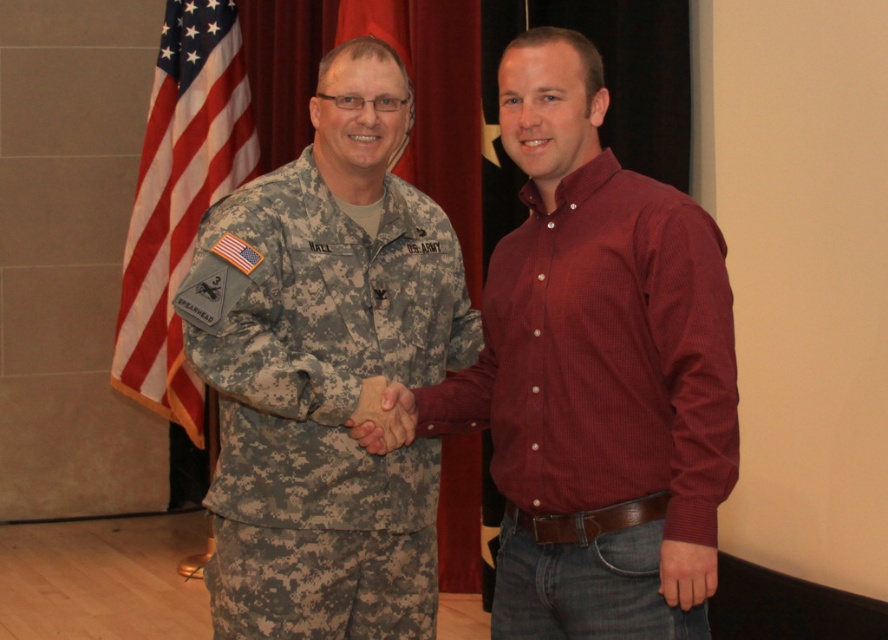
Between american flag at left and red flag at center, which one appears on the right side from the viewer's perspective?

red flag at center is more to the right.

At what (x,y) coordinates should I click in order to perform the action: click on american flag at left. Please return your answer as a coordinate pair (x, y). The width and height of the screenshot is (888, 640). Looking at the image, I should click on (180, 196).

Does american flag at left appear on the left side of matte skin hand at center?

Indeed, american flag at left is positioned on the left side of matte skin hand at center.

From the picture: Is american flag at left behind matte skin hand at center?

Yes, american flag at left is further from the viewer.

Who is more forward, (x=178, y=67) or (x=369, y=390)?

Positioned in front is point (x=369, y=390).

At what (x,y) coordinates should I click in order to perform the action: click on american flag at left. Please return your answer as a coordinate pair (x, y). Looking at the image, I should click on (180, 196).

Between point (236, 296) and point (707, 298), which one is positioned behind?

The point (236, 296) is behind.

Does camouflage fabric uniform at center have a greater width compared to matte red shirt at center?

Yes.

Is point (255, 600) positioned before point (657, 385)?

That is False.

Locate an element on the screen. This screenshot has height=640, width=888. camouflage fabric uniform at center is located at coordinates (321, 403).